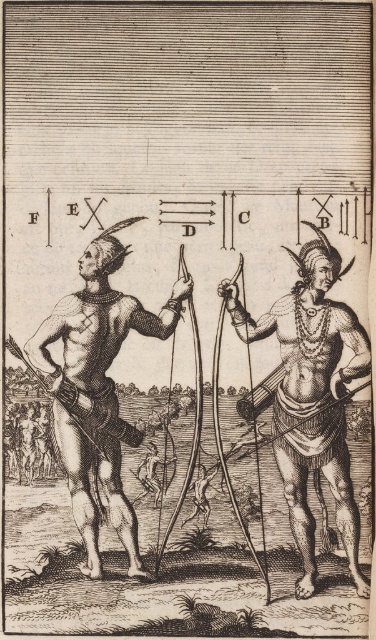
Is smooth wood bow at center smaller than black textured skin at left?

Yes.

Which is behind, point (295, 442) or point (107, 387)?

The point (107, 387) is more distant.

I want to click on smooth wood bow at center, so click(x=312, y=396).